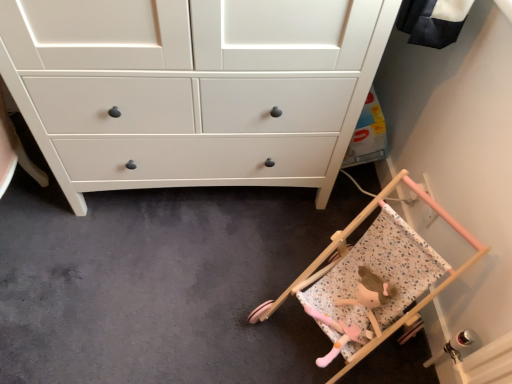
Question: Considering their positions, is fluffy pink doll at lower right located in front of or behind wooden baby carriage at lower right?

Choices:
 (A) behind
 (B) front

Answer: (A)

Question: Is fluffy pink doll at lower right spatially inside wooden baby carriage at lower right, or outside of it?

Choices:
 (A) outside
 (B) inside

Answer: (B)

Question: Considering the positions of point (352, 329) and point (268, 314), is point (352, 329) closer or farther from the camera than point (268, 314)?

Choices:
 (A) closer
 (B) farther

Answer: (A)

Question: From a real-world perspective, is wooden baby carriage at lower right above or below fluffy pink doll at lower right?

Choices:
 (A) above
 (B) below

Answer: (A)

Question: Relative to fluffy pink doll at lower right, is wooden baby carriage at lower right in front or behind?

Choices:
 (A) behind
 (B) front

Answer: (B)

Question: Considering the positions of wooden baby carriage at lower right and fluffy pink doll at lower right in the image, is wooden baby carriage at lower right wider or thinner than fluffy pink doll at lower right?

Choices:
 (A) thin
 (B) wide

Answer: (B)

Question: Is wooden baby carriage at lower right spatially inside fluffy pink doll at lower right, or outside of it?

Choices:
 (A) outside
 (B) inside

Answer: (A)